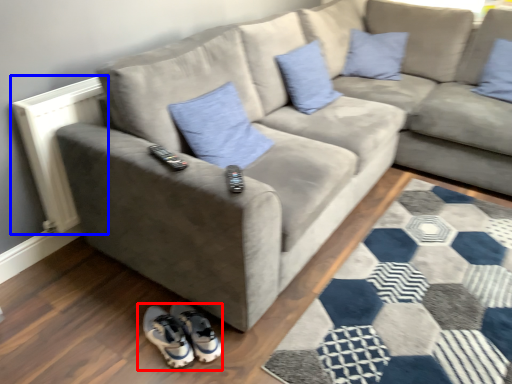
Question: Which object appears farthest to the camera in this image, footwear (highlighted by a red box) or radiator (highlighted by a blue box)?

Choices:
 (A) footwear
 (B) radiator

Answer: (B)